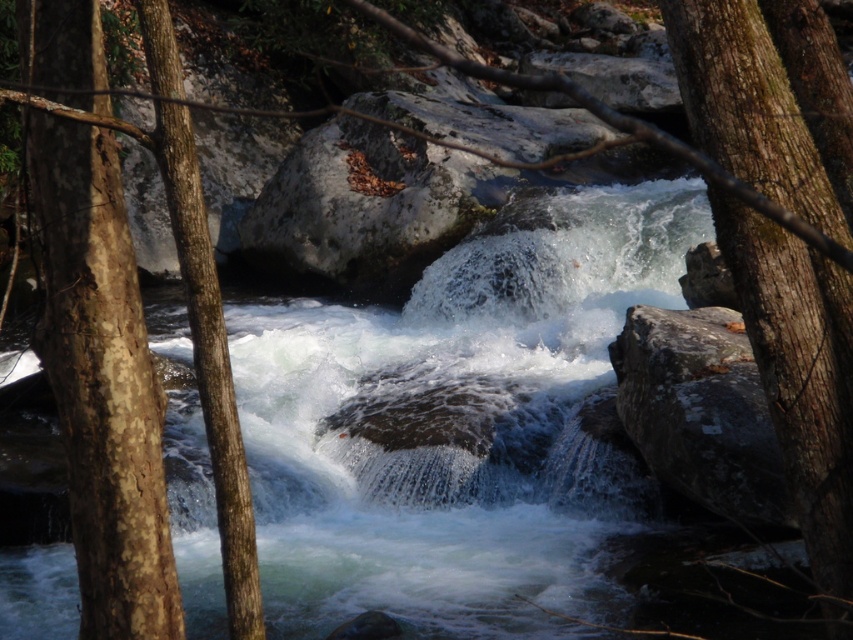
Which is more to the left, brown rough bark tree at right or gray/rough rock at center-right?

brown rough bark tree at right

Does brown rough bark tree at right have a larger size compared to gray/rough rock at center-right?

Incorrect, brown rough bark tree at right is not larger than gray/rough rock at center-right.

Where is `brown rough bark tree at right`? The height and width of the screenshot is (640, 853). brown rough bark tree at right is located at coordinates (799, 372).